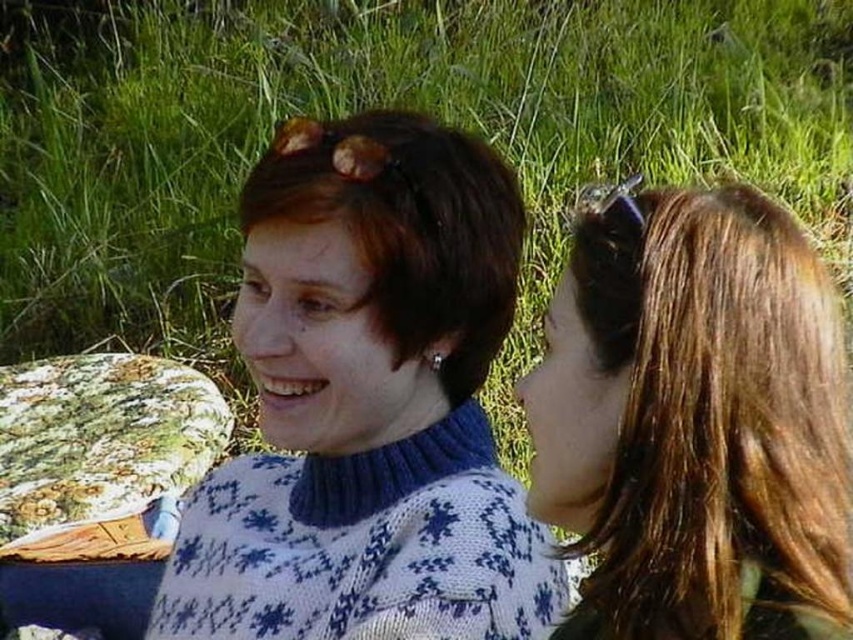
Question: Does white knitted sweater at center have a larger size compared to shiny brown hair at right?

Choices:
 (A) no
 (B) yes

Answer: (B)

Question: Can you confirm if white knitted sweater at center is thinner than shiny brown hair at right?

Choices:
 (A) no
 (B) yes

Answer: (A)

Question: Which of these objects is positioned farthest from the shiny brown hair at right?

Choices:
 (A) matte blue sweater at center
 (B) white knitted sweater at center

Answer: (A)

Question: Is shiny brown hair at right above matte blue sweater at center?

Choices:
 (A) no
 (B) yes

Answer: (A)

Question: Which of the following is the farthest from the observer?

Choices:
 (A) (380, 589)
 (B) (662, 483)
 (C) (432, 200)

Answer: (C)

Question: Which object is the farthest from the shiny brown hair at right?

Choices:
 (A) white knitted sweater at center
 (B) matte blue sweater at center

Answer: (B)